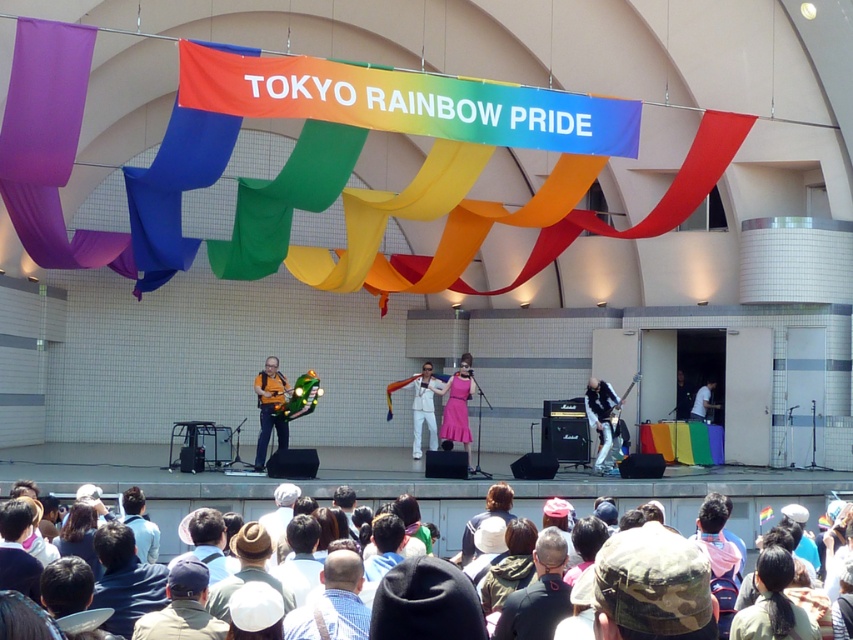
Question: Which point is farther from the camera taking this photo?

Choices:
 (A) (561, 602)
 (B) (190, 556)

Answer: (B)

Question: Does dark gray fabric jacket at center appear on the right side of blue plaid shirt at center?

Choices:
 (A) yes
 (B) no

Answer: (A)

Question: Does metallic silver guitar at center come in front of glossy black guitar at center?

Choices:
 (A) no
 (B) yes

Answer: (B)

Question: Which point is closer to the camera taking this photo?

Choices:
 (A) (201, 602)
 (B) (607, 387)
 (C) (172, 554)

Answer: (A)

Question: Considering the real-world distances, which object is farthest from the dark gray fabric jacket at center?

Choices:
 (A) glossy black guitar at center
 (B) metallic silver guitar at center
 (C) multicolored fabric at lower center
 (D) camouflage hat at lower center

Answer: (A)

Question: Is blue plaid shirt at center to the left of camouflage hat at lower center from the viewer's perspective?

Choices:
 (A) no
 (B) yes

Answer: (A)